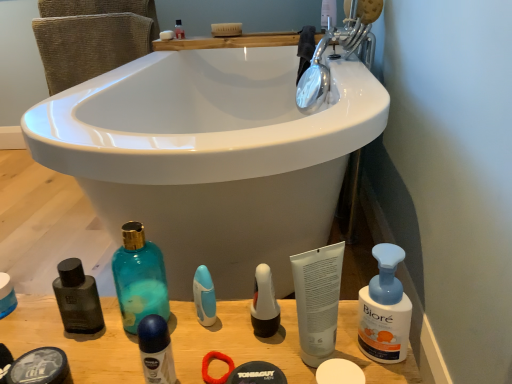
Question: From a real-world perspective, is blue matte deodorant at center, acting as the fifth toiletry starting from the back, on translucent plastic soap at upper center, which is the first toiletry in left-to-right order?

Choices:
 (A) no
 (B) yes

Answer: (A)

Question: Can you confirm if blue matte deodorant at center, arranged as the fourth toiletry when viewed from the right, is wider than translucent plastic soap at upper center, which appears as the sixth toiletry when viewed from the front?

Choices:
 (A) yes
 (B) no

Answer: (A)

Question: Considering the relative positions of blue matte deodorant at center, arranged as the fourth toiletry when viewed from the right, and translucent plastic soap at upper center, which is the first toiletry in left-to-right order, in the image provided, is blue matte deodorant at center, arranged as the fourth toiletry when viewed from the right, behind translucent plastic soap at upper center, which is the first toiletry in left-to-right order,?

Choices:
 (A) yes
 (B) no

Answer: (B)

Question: From the image's perspective, is blue matte deodorant at center, arranged as the fourth toiletry when viewed from the right, on top of translucent plastic soap at upper center, the 1th toiletry when ordered from back to front?

Choices:
 (A) yes
 (B) no

Answer: (B)

Question: Can you confirm if blue matte deodorant at center, arranged as the fourth toiletry when viewed from the right, is bigger than translucent plastic soap at upper center, the 6th toiletry in the bottom-to-top sequence?

Choices:
 (A) no
 (B) yes

Answer: (B)

Question: Is blue matte deodorant at center, positioned as the 3th toiletry in left-to-right order, turned away from translucent plastic soap at upper center, the 6th toiletry in the bottom-to-top sequence?

Choices:
 (A) no
 (B) yes

Answer: (A)

Question: Is white matte soap at lower center, the second soap viewed from the top, positioned behind wooden counter top at lower center?

Choices:
 (A) yes
 (B) no

Answer: (B)

Question: Considering the relative sizes of white matte soap at lower center, positioned as the 1th soap in bottom-to-top order, and wooden counter top at lower center in the image provided, is white matte soap at lower center, positioned as the 1th soap in bottom-to-top order, smaller than wooden counter top at lower center?

Choices:
 (A) no
 (B) yes

Answer: (B)

Question: From a real-world perspective, is white matte soap at lower center, which is counted as the 2th soap, starting from the left, located beneath wooden counter top at lower center?

Choices:
 (A) yes
 (B) no

Answer: (B)

Question: Is white matte soap at lower center, positioned as the 1th soap in bottom-to-top order, turned away from wooden counter top at lower center?

Choices:
 (A) yes
 (B) no

Answer: (B)

Question: Is white matte soap at lower center, the 1th soap in the front-to-back sequence, not inside wooden counter top at lower center?

Choices:
 (A) yes
 (B) no

Answer: (A)

Question: Is the depth of white matte soap at lower center, the second soap viewed from the top, less than that of wooden counter top at lower center?

Choices:
 (A) yes
 (B) no

Answer: (A)

Question: From the image's perspective, is white matte soap at lower center, positioned as the 1th soap in bottom-to-top order, on top of white matte soap at upper center, which is the second soap from front to back?

Choices:
 (A) yes
 (B) no

Answer: (B)